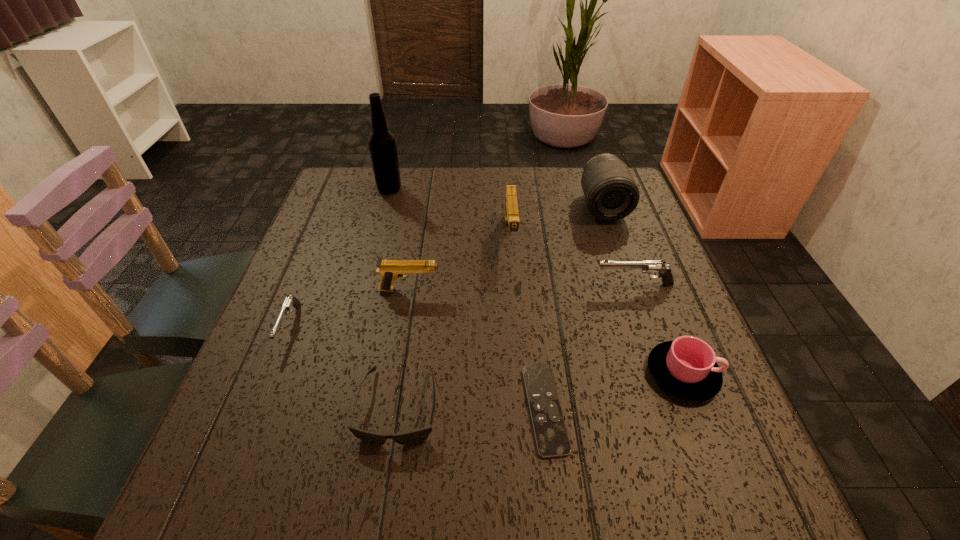
Where is `the left silver pistol`? This screenshot has height=540, width=960. the left silver pistol is located at coordinates (290, 302).

Identify the location of the leftmost object. This screenshot has height=540, width=960. (290, 302).

What are the coordinates of `the eighth tallest object` in the screenshot? It's located at (411, 437).

Find the location of a particular element. the shortest object is located at coordinates (551, 436).

Where is `free space located 0.090m on the left of the second object from left to right`? This screenshot has height=540, width=960. free space located 0.090m on the left of the second object from left to right is located at coordinates (347, 189).

I want to click on free spot located on the surface of the gray telephoto lens, so [618, 248].

Where is `vacant space located at the barrel of the third pistol from left to right`? The height and width of the screenshot is (540, 960). vacant space located at the barrel of the third pistol from left to right is located at coordinates (517, 329).

I want to click on free point located 0.360m at the barrel of the nearer tan pistol, so click(598, 290).

Locate an element on the screen. This screenshot has width=960, height=540. free location located on the front-facing side of the rightmost pistol is located at coordinates click(420, 285).

What are the coordinates of `free space located 0.400m on the front-facing side of the rightmost pistol` in the screenshot? It's located at click(x=420, y=285).